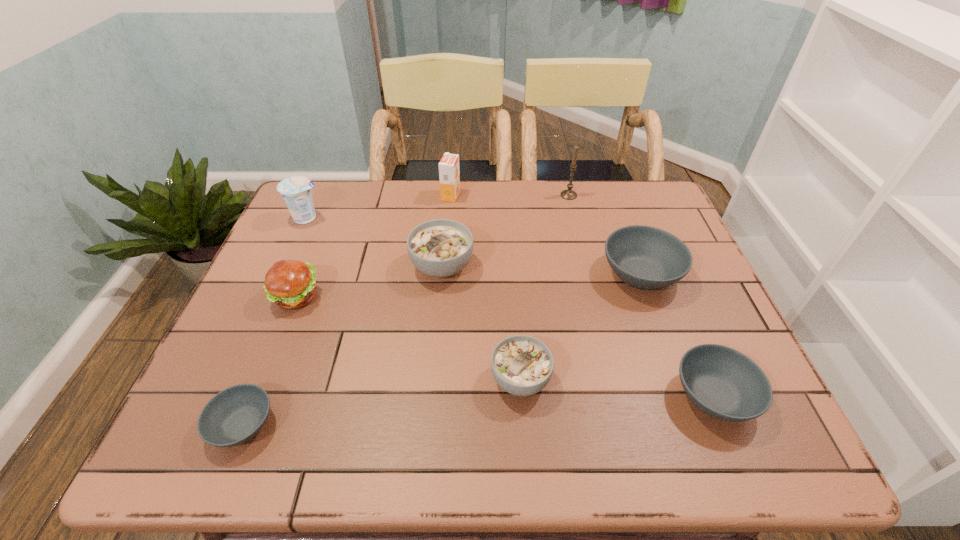
Where is `soup bowl located in the left edge section of the desktop`? soup bowl located in the left edge section of the desktop is located at coordinates (236, 414).

You are a GUI agent. You are given a task and a screenshot of the screen. Output one action in this format:
    pyautogui.click(x=<x>, y=<y>)
    Task: Click on the object that is at the far left corner
    The height and width of the screenshot is (540, 960).
    Given the screenshot: What is the action you would take?
    pyautogui.click(x=296, y=192)

Where is `object positioned at the near left corner`? object positioned at the near left corner is located at coordinates (236, 414).

Image resolution: width=960 pixels, height=540 pixels. In order to click on object at the near right corner in this screenshot , I will do `click(723, 382)`.

Find the location of a particular element. vacant region at the far edge of the desktop is located at coordinates (391, 203).

In the image, there is a desktop. Identify the location of vacant space at the near edge. (497, 443).

Identify the location of free space at the left edge of the desktop. The width and height of the screenshot is (960, 540). (300, 332).

I want to click on vacant space at the right edge of the desktop, so click(685, 323).

What are the coordinates of `free space at the near left corner of the desktop` in the screenshot? It's located at (193, 425).

Find the location of a particular element. The image size is (960, 540). vacant space at the far right corner of the desktop is located at coordinates (647, 221).